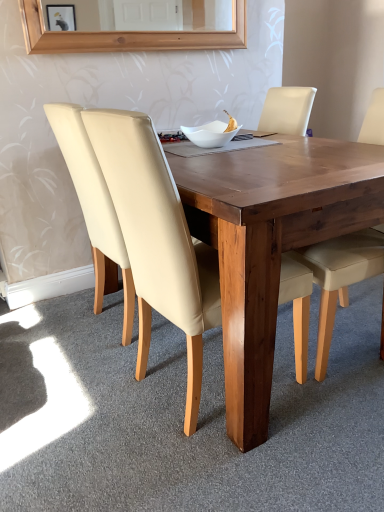
Where is `free spot to the right of white glossy bowl at center`? This screenshot has width=384, height=512. free spot to the right of white glossy bowl at center is located at coordinates (264, 144).